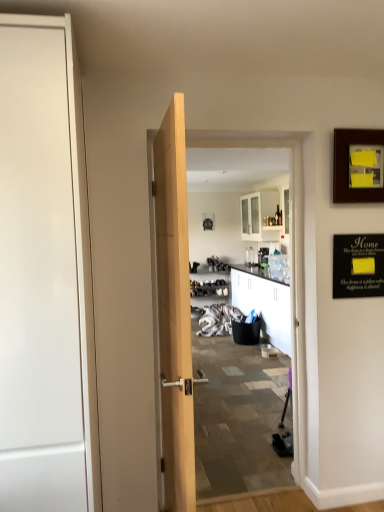
Question: From the image's perspective, is black matte bulletin board at upper right located above or below white glossy door at left?

Choices:
 (A) above
 (B) below

Answer: (A)

Question: Would you say black matte bulletin board at upper right is to the left or to the right of white glossy door at left in the picture?

Choices:
 (A) left
 (B) right

Answer: (B)

Question: Which object is positioned closest to the white glossy door at left?

Choices:
 (A) wooden picture frame at upper right, placed as the 1th picture frame when sorted from right to left
 (B) wooden picture frame at center, acting as the 2th picture frame starting from the right
 (C) black matte bulletin board at upper right

Answer: (C)

Question: Which object is positioned farthest from the wooden picture frame at upper right, the first picture frame in the front-to-back sequence?

Choices:
 (A) white glossy door at left
 (B) wooden picture frame at center, acting as the 1th picture frame starting from the back
 (C) black matte bulletin board at upper right

Answer: (B)